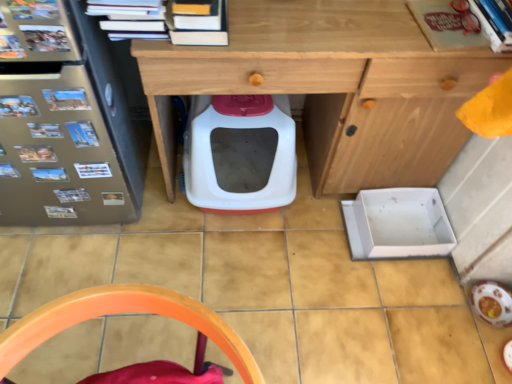
The width and height of the screenshot is (512, 384). Find the location of `free location to the right of metallic silver fridge at left`. free location to the right of metallic silver fridge at left is located at coordinates [182, 226].